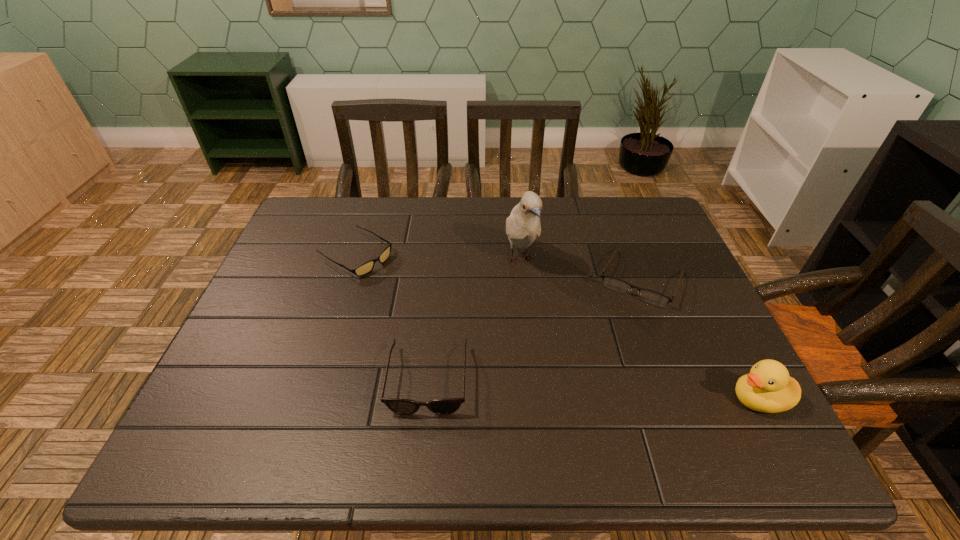
Find the location of a particular element. This screenshot has height=540, width=960. empty space between the duckling and the farther sunglasses is located at coordinates (558, 327).

Identify the location of free space that is in between the spectacles and the second object from left to right. This screenshot has width=960, height=540. (535, 329).

Locate an element on the screen. unoccupied area between the duckling and the leftmost object is located at coordinates (558, 327).

Locate an element on the screen. Image resolution: width=960 pixels, height=540 pixels. free spot between the shorter sunglasses and the third object from left to right is located at coordinates (439, 257).

The image size is (960, 540). I want to click on vacant space that is in between the shorter sunglasses and the spectacles, so click(498, 267).

Identify which object is the second nearest to the farther sunglasses. Please provide its 2D coordinates. Your answer should be formatted as a tuple, i.e. [(x, y)], where the tuple contains the x and y coordinates of a point satisfying the conditions above.

[(523, 225)]

The height and width of the screenshot is (540, 960). What are the coordinates of `object that stands as the third closest to the taller sunglasses` in the screenshot? It's located at (652, 297).

Image resolution: width=960 pixels, height=540 pixels. Find the location of `vacant area in the image that satisfies the following two spatial constraints: 1. on the front side of the farther sunglasses; 2. on the left side of the third object from right to left`. vacant area in the image that satisfies the following two spatial constraints: 1. on the front side of the farther sunglasses; 2. on the left side of the third object from right to left is located at coordinates (355, 259).